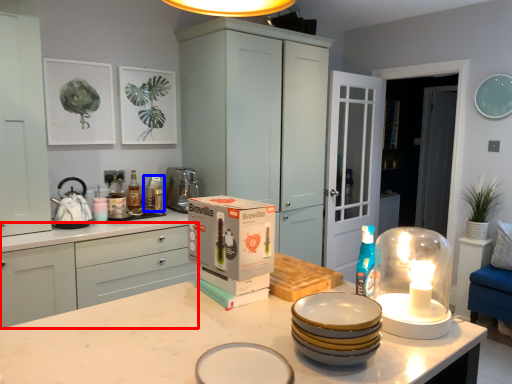
Question: Which object is further to the camera taking this photo, cabinetry (highlighted by a red box) or appliance (highlighted by a blue box)?

Choices:
 (A) cabinetry
 (B) appliance

Answer: (B)